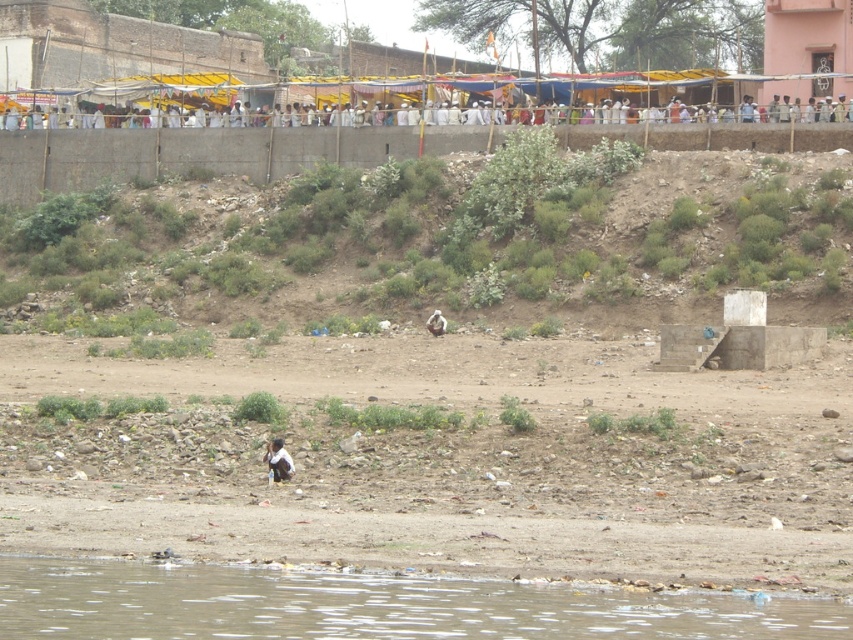
Question: Which object is positioned closest to the white clothed people at upper center?

Choices:
 (A) green grassy hillside at center
 (B) brown dirt field at lower center
 (C) brown sedimentary river at lower left
 (D) dark blue fabric at lower center

Answer: (A)

Question: Among these objects, which one is farthest from the camera?

Choices:
 (A) green grassy hillside at center
 (B) brown dirt field at lower center
 (C) brown sedimentary river at lower left

Answer: (A)

Question: Can you confirm if green grassy hillside at center is positioned to the left of brown sedimentary river at lower left?

Choices:
 (A) no
 (B) yes

Answer: (B)

Question: Observing the image, what is the correct spatial positioning of brown dirt field at lower center in reference to dark blue fabric at lower center?

Choices:
 (A) left
 (B) right

Answer: (B)

Question: Is brown sedimentary river at lower left positioned at the back of white clothed people at upper center?

Choices:
 (A) yes
 (B) no

Answer: (B)

Question: Among these points, which one is farthest from the camera?

Choices:
 (A) (158, 368)
 (B) (679, 264)
 (C) (263, 120)

Answer: (C)